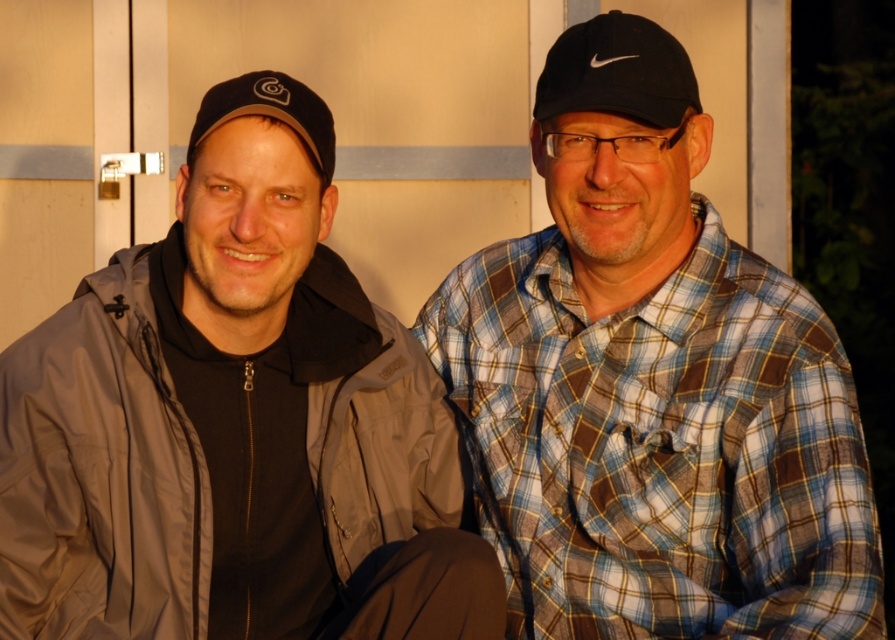
Between matte black jacket at left and black nike cap at center, which one is positioned higher?

Positioned higher is black nike cap at center.

Who is positioned more to the left, matte black jacket at left or black nike cap at center?

Positioned to the left is matte black jacket at left.

Which is in front, point (185, 292) or point (539, 109)?

Point (539, 109) is more forward.

You are a GUI agent. You are given a task and a screenshot of the screen. Output one action in this format:
    pyautogui.click(x=<x>, y=<y>)
    Task: Click on the matte black jacket at left
    The image size is (895, 640).
    Given the screenshot: What is the action you would take?
    pyautogui.click(x=235, y=422)

Is black nike cap at center bigger than black matte baseball cap at left?

Yes, black nike cap at center is bigger than black matte baseball cap at left.

Which is above, black nike cap at center or black matte baseball cap at left?

black nike cap at center

Which is behind, point (547, 106) or point (309, 88)?

Point (309, 88)

The height and width of the screenshot is (640, 895). I want to click on black nike cap at center, so click(x=618, y=72).

Does blue plaid shirt at center have a larger size compared to black matte baseball cap at left?

Yes.

Is blue plaid shirt at center below black matte baseball cap at left?

Yes, blue plaid shirt at center is below black matte baseball cap at left.

The height and width of the screenshot is (640, 895). What do you see at coordinates (652, 385) in the screenshot? I see `blue plaid shirt at center` at bounding box center [652, 385].

Identify the location of blue plaid shirt at center. The image size is (895, 640). (652, 385).